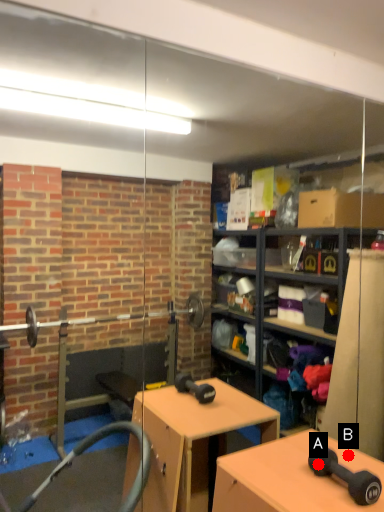
Question: Two points are circled on the image, labeled by A and B beside each circle. Which point is farther from the camera taking this photo?

Choices:
 (A) A is further
 (B) B is further

Answer: (B)